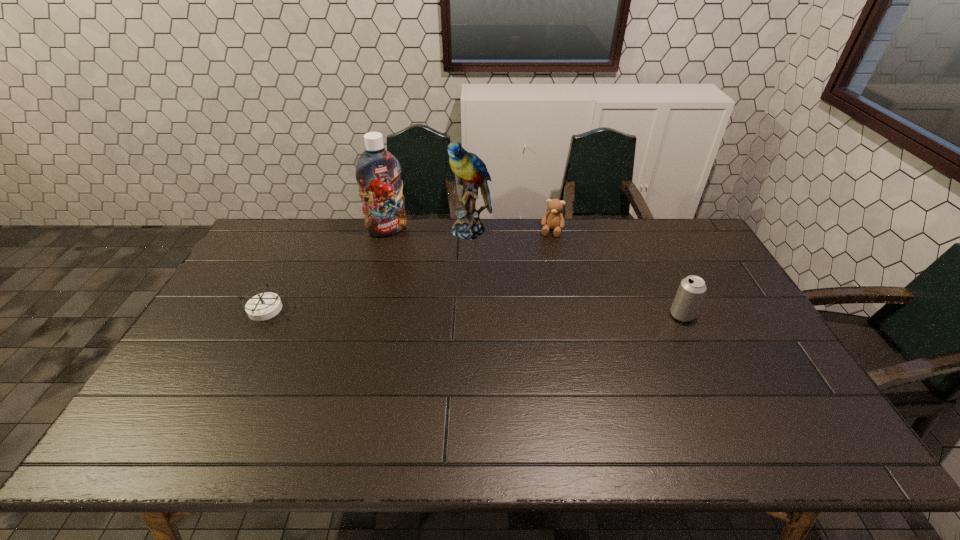
This screenshot has height=540, width=960. Identify the location of object that is at the left edge. (264, 306).

This screenshot has height=540, width=960. In the image, there is a desktop. Find the location of `vacant space at the far edge`. vacant space at the far edge is located at coordinates (614, 258).

Identify the location of vacant space at the near edge. (563, 399).

Locate an element on the screen. vacant space at the left edge of the desktop is located at coordinates (255, 294).

Identify the location of vacant area at the right edge. (715, 316).

You are a GUI agent. You are given a task and a screenshot of the screen. Output one action in this format:
    pyautogui.click(x=<x>, y=<y>)
    Task: Click on the vacant space at the near left corner of the desktop
    
    Given the screenshot: What is the action you would take?
    pyautogui.click(x=154, y=408)

Find the location of a particular element. The width and height of the screenshot is (960, 540). free space at the near right corner of the desktop is located at coordinates (784, 394).

Where is `blank region between the leftmost object and the beer can`? The width and height of the screenshot is (960, 540). blank region between the leftmost object and the beer can is located at coordinates pyautogui.click(x=473, y=312).

I want to click on empty location between the rightmost object and the fourth object from left to right, so click(x=616, y=273).

Identify the location of vacant space that's between the compass and the fourth object from right to left. (326, 269).